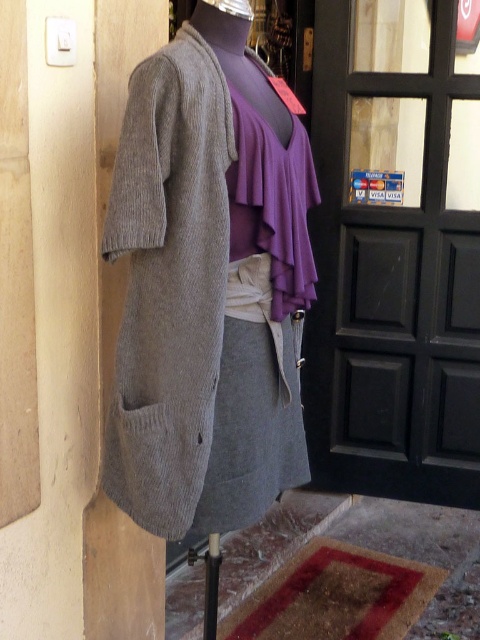
Consider the image. You are standing at the door and want to move towards the mannequin. Which point, point (x=172, y=538) or point (x=445, y=102), is closer to your current position?

Point (x=172, y=538) is in front of point (x=445, y=102), so it is closer to your current position at the door.

You need to place a rectangular box that is 1.2 meters wide on the floor. The knitted gray jacket at center and the black glass door at upper right are in the way. Which object do you need to move to make space?

The knitted gray jacket at center has a width less than the black glass door at upper right. Since the box is 1.2 meters wide, you need to move the black glass door at upper right because it is wider than the jacket and might block the space required for the box.

You are standing in a store and see the knitted gray jacket at center. If you want to reach it, which direction should you move relative to your current position?

Since the knitted gray jacket at center is located at point coordinates, you need to move towards the center of the store to reach it.